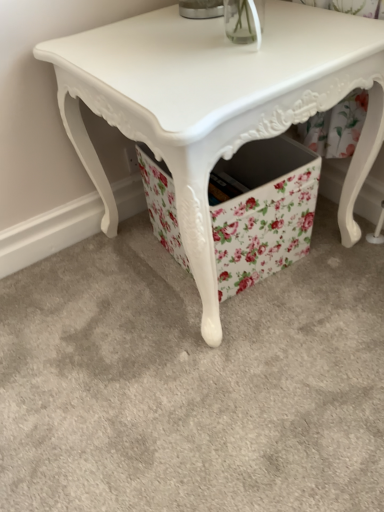
At what (x,y) coordinates should I click in order to perform the action: click on vacant area situated to the left side of floral fabric storage box at lower center. Please return your answer as a coordinate pair (x, y). This screenshot has height=512, width=384. Looking at the image, I should click on (125, 275).